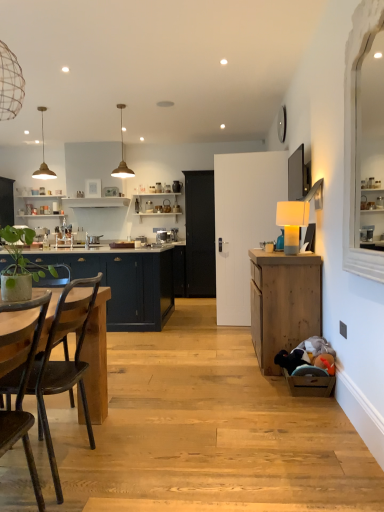
Question: From their relative heights in the image, would you say satin silver toaster at center is taller or shorter than black matte door at center?

Choices:
 (A) short
 (B) tall

Answer: (A)

Question: Does point (173, 239) appear closer or farther from the camera than point (193, 212)?

Choices:
 (A) farther
 (B) closer

Answer: (B)

Question: Which of these objects is positioned closest to the matte gold pendant light at upper center, the 1th lamp positioned from the left?

Choices:
 (A) matte gold pendant light at upper center, marked as the 3th lamp in a bottom-to-top arrangement
 (B) rustic wood chair at left
 (C) wooden cabinet at right, marked as the second cabinetry in a left-to-right arrangement
 (D) matte dark blue cabinets at left, which is the 2th cabinetry from front to back
 (E) black matte door at center

Answer: (A)

Question: Estimate the real-world distances between objects in this image. Which object is closer to the matte dark blue cabinets at left, the second cabinetry in the right-to-left sequence?

Choices:
 (A) black matte door at center
 (B) rustic wood chair at left
 (C) white matte lamp at right, arranged as the first lamp when viewed from the front
 (D) wooden cabinet at right, which is the first cabinetry from right to left
 (E) matte gold pendant light at upper center, arranged as the second lamp when viewed from the front

Answer: (D)